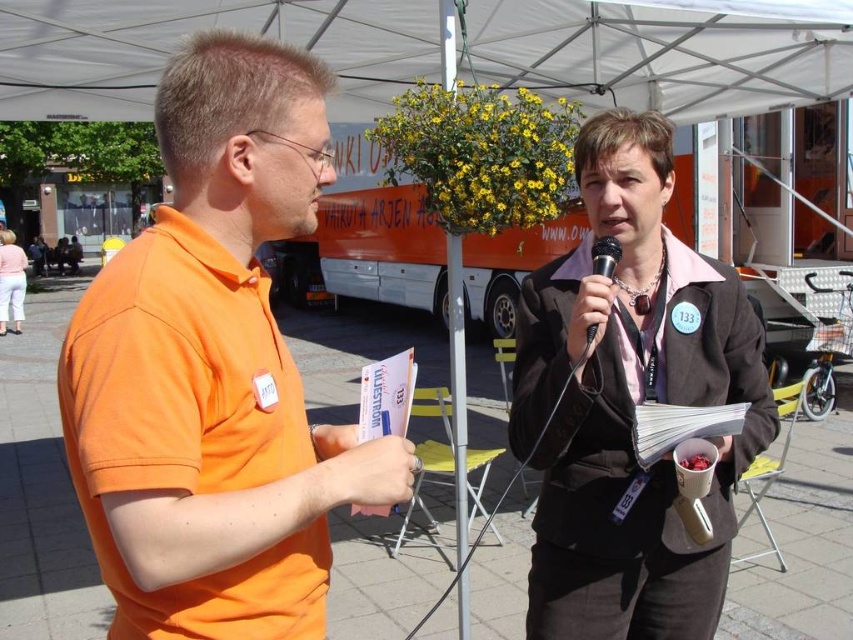
You are at an event and need to locate the person wearing the matte pink shirt at lower left. Based on the scene description, which direction should you look relative to the matte black blazer at center?

The matte black blazer at center is to the right of the matte pink shirt at lower left, so you should look to the left of the matte black blazer at center to find the matte pink shirt at lower left.

You are a photographer at the event and need to adjust your camera settings to focus on the matte black blazer at center and the black metallic microphone at center. Which object should you set a longer focal length for to capture more detail?

The matte black blazer at center is much taller than the black metallic microphone at center, so you should set a longer focal length for the matte black blazer at center to capture more detail.